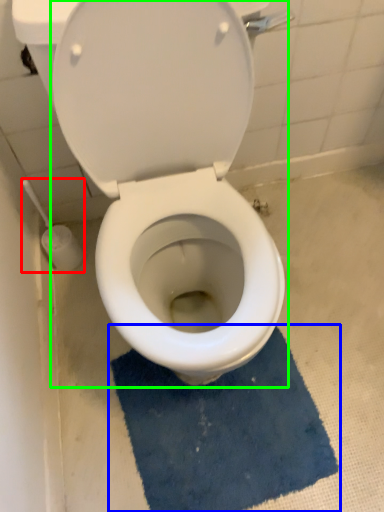
Question: Considering the real-world distances, which object is farthest from brush (highlighted by a red box)? bath mat (highlighted by a blue box) or toilet (highlighted by a green box)?

Choices:
 (A) bath mat
 (B) toilet

Answer: (A)